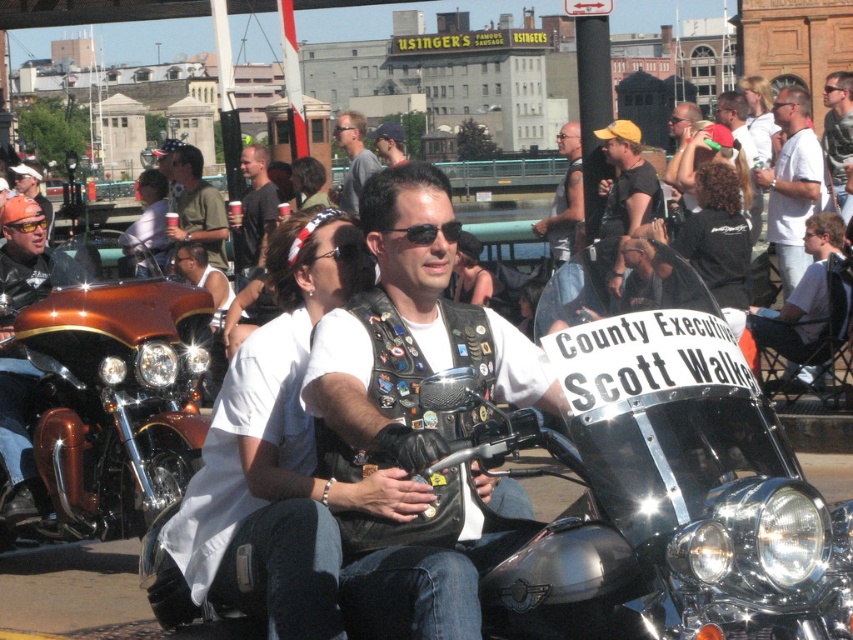
From the picture: Is white t-shirt at center to the left of brushed metal goggles at upper center from the viewer's perspective?

Correct, you'll find white t-shirt at center to the left of brushed metal goggles at upper center.

Is white t-shirt at center closer to the viewer compared to brushed metal goggles at upper center?

That is False.

Does point (137, 244) come closer to viewer compared to point (16, 224)?

No, (137, 244) is behind (16, 224).

In order to click on white t-shirt at center in this screenshot , I will do `click(148, 228)`.

Does shiny gold motorcycle at left appear under white cotton shirt at upper center?

Indeed, shiny gold motorcycle at left is positioned under white cotton shirt at upper center.

Is shiny gold motorcycle at left to the left of white cotton shirt at upper center from the viewer's perspective?

Yes, shiny gold motorcycle at left is to the left of white cotton shirt at upper center.

What do you see at coordinates (18, 440) in the screenshot? The height and width of the screenshot is (640, 853). I see `shiny gold motorcycle at left` at bounding box center [18, 440].

Locate an element on the screen. The image size is (853, 640). shiny gold motorcycle at left is located at coordinates (18, 440).

Who is more forward, (802, 108) or (828, 150)?

Point (802, 108) is in front.

I want to click on white cotton shirt at upper center, so click(792, 184).